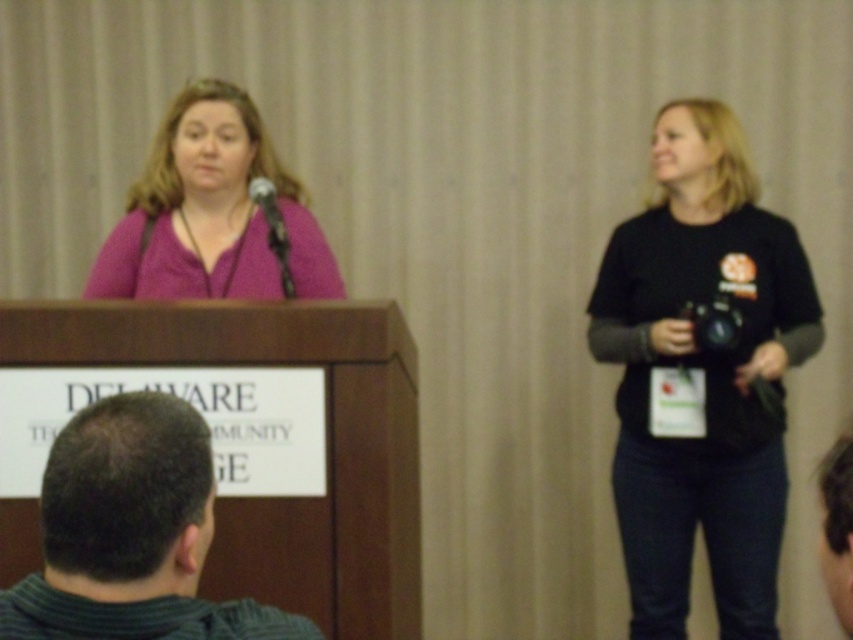
You are attending a conference and notice a speaker at the podium. There is also a person at point (x=700, y=376) in the image. What is the person at that coordinate wearing?

The person at point (x=700, y=376) is wearing a black matte shirt at right.

You are standing at the center of the image. Which direction should you move to find the dark green striped shirt at lower left?

The dark green striped shirt at lower left is located at point [131,532], which is to the left and slightly below the center of the image. Move towards the lower left direction to find it.